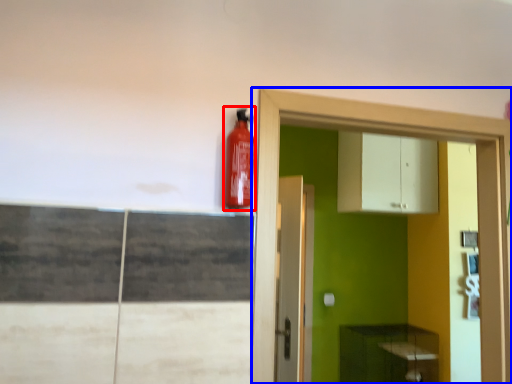
Question: Which object appears closest to the camera in this image, extinguisher (highlighted by a red box) or dresser (highlighted by a blue box)?

Choices:
 (A) extinguisher
 (B) dresser

Answer: (A)